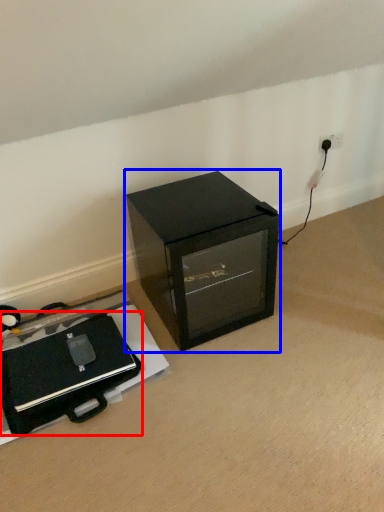
Question: Among these objects, which one is farthest to the camera, wide (highlighted by a red box) or furniture (highlighted by a blue box)?

Choices:
 (A) wide
 (B) furniture

Answer: (B)